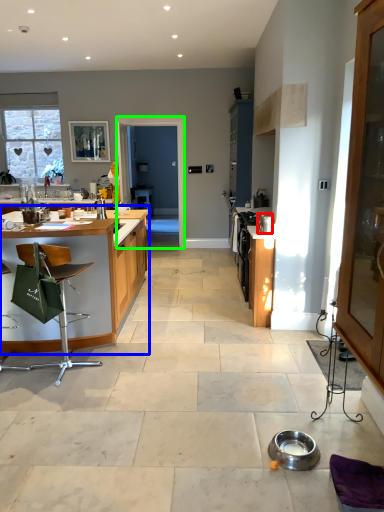
Question: Considering the real-world distances, which object is farthest from appliance (highlighted by a red box)? table (highlighted by a blue box) or screen door (highlighted by a green box)?

Choices:
 (A) table
 (B) screen door

Answer: (B)